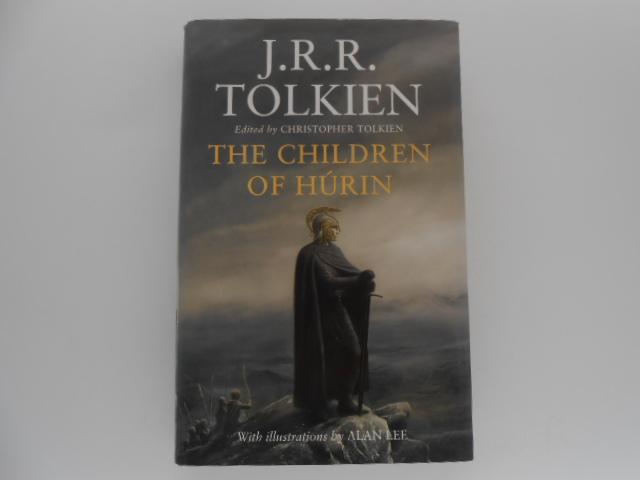
Where is `robe`? The width and height of the screenshot is (640, 480). robe is located at coordinates (324, 312).